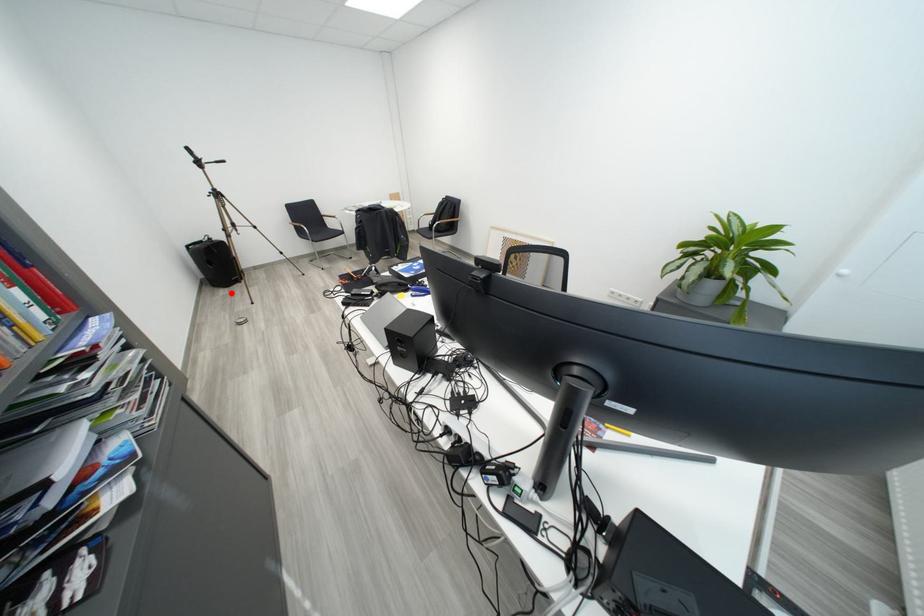
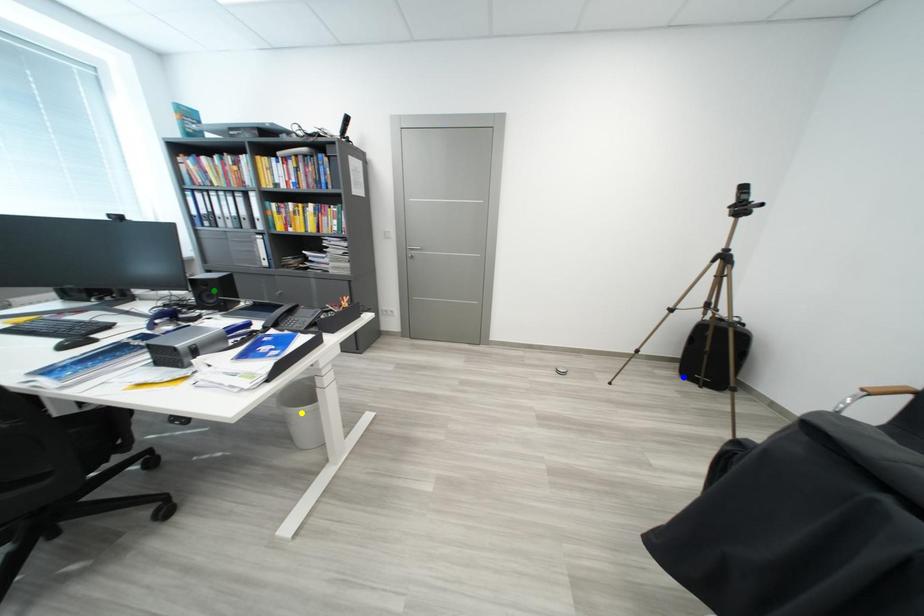
Question: I am providing you with two images of the same scene from different viewpoints. A red point is marked on the first image. You are given multiple points on the second image. Can you choose the point in image 2 that corresponds to the point in image 1?

Choices:
 (A) green point
 (B) blue point
 (C) yellow point

Answer: (B)